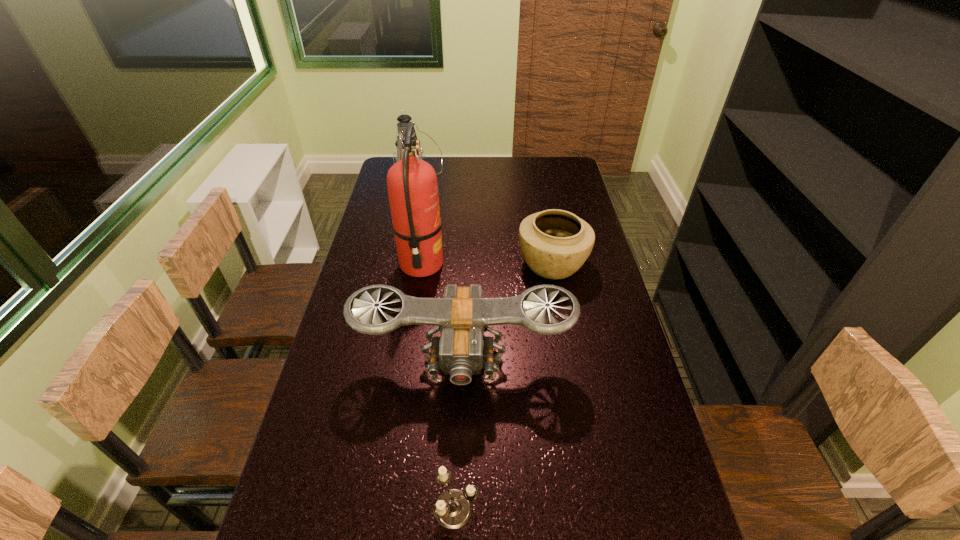
Find the location of a particular element. This screenshot has height=540, width=960. fire extinguisher is located at coordinates (412, 186).

This screenshot has height=540, width=960. I want to click on the fourth shortest object, so click(404, 119).

Where is `oil lamp`? oil lamp is located at coordinates click(x=404, y=119).

This screenshot has height=540, width=960. Find the location of `the fourth farthest object`. the fourth farthest object is located at coordinates (462, 316).

Image resolution: width=960 pixels, height=540 pixels. I want to click on drone, so click(462, 316).

Find the location of a particular element. pottery is located at coordinates (554, 243).

This screenshot has width=960, height=540. I want to click on candle holder, so click(453, 509).

The width and height of the screenshot is (960, 540). Identify the location of the nearest object. (453, 509).

I want to click on free space located 0.310m on the side of the fire extinguisher with the nozzle and handle, so click(534, 265).

At what (x,y) coordinates should I click in order to perform the action: click on free point located 0.090m on the right of the oil lamp. Please return your answer as a coordinate pair (x, y). Looking at the image, I should click on (466, 191).